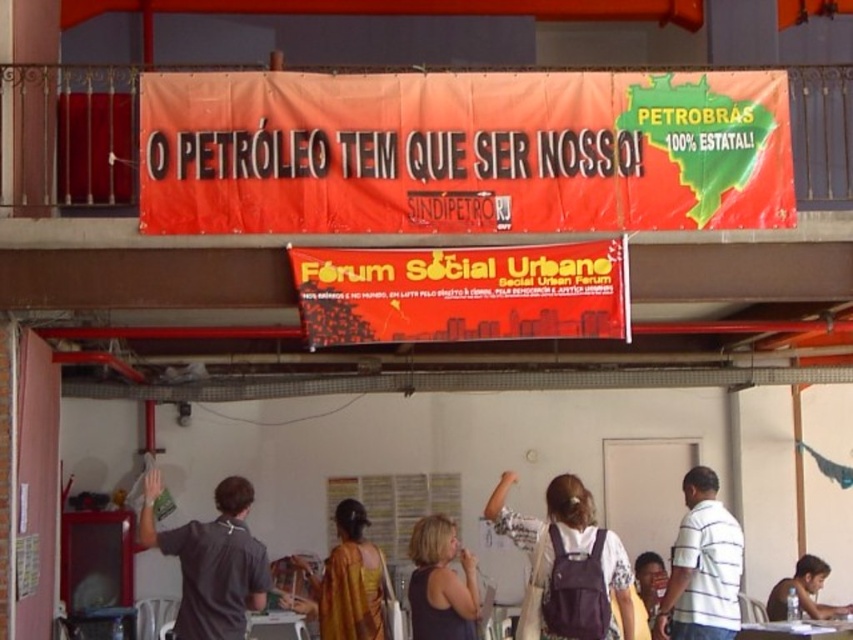
Where is `white striped shirt at center`? This screenshot has height=640, width=853. white striped shirt at center is located at coordinates (701, 566).

Is point (674, 566) closer to viewer compared to point (430, 618)?

No, (674, 566) is further to viewer.

Image resolution: width=853 pixels, height=640 pixels. Describe the element at coordinates (701, 566) in the screenshot. I see `white striped shirt at center` at that location.

This screenshot has width=853, height=640. I want to click on white striped shirt at center, so click(701, 566).

Measure the distance between white striped shirt at center and smooth brown shirt at lower right.

white striped shirt at center is 3.74 meters from smooth brown shirt at lower right.

Who is more forward, (659, 632) or (802, 557)?

Point (659, 632) is in front.

Who is more forward, (x=680, y=522) or (x=808, y=598)?

Point (x=680, y=522) is more forward.

The image size is (853, 640). Find the location of `white striped shirt at center`. white striped shirt at center is located at coordinates (701, 566).

Does white fabric backpack at center have a lesser height compared to dark gray tank top at center?

In fact, white fabric backpack at center may be taller than dark gray tank top at center.

Is white fabric backpack at center further to camera compared to dark gray tank top at center?

No, white fabric backpack at center is closer to the viewer.

Between point (602, 540) and point (413, 627), which one is positioned behind?

Positioned behind is point (413, 627).

Identify the location of white fabric backpack at center. (567, 564).